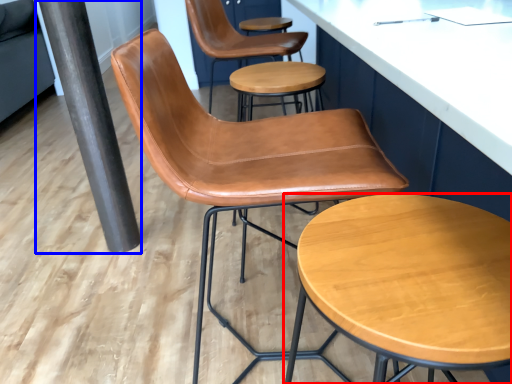
Question: Which point is closer to the camera, stool (highlighted by a red box) or beam (highlighted by a blue box)?

Choices:
 (A) stool
 (B) beam

Answer: (A)